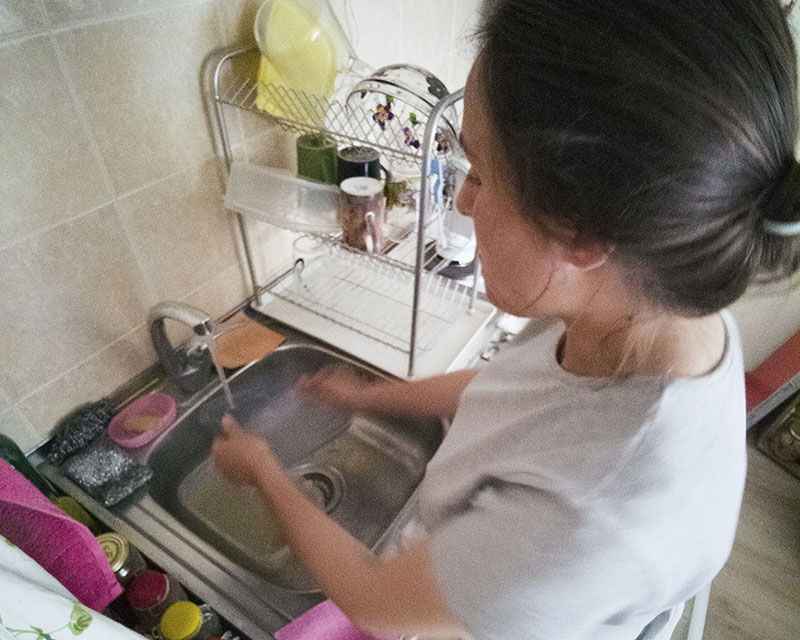
Find the location of a particular element. Image resolution: width=800 pixels, height=640 pixels. sink is located at coordinates (386, 468).